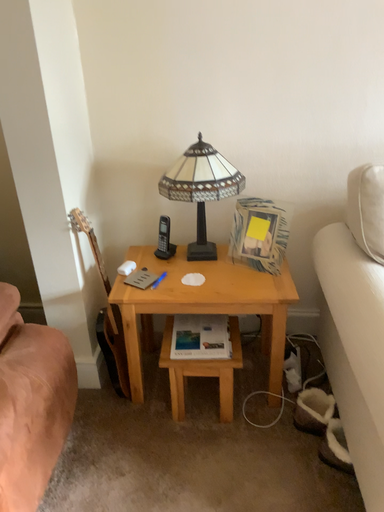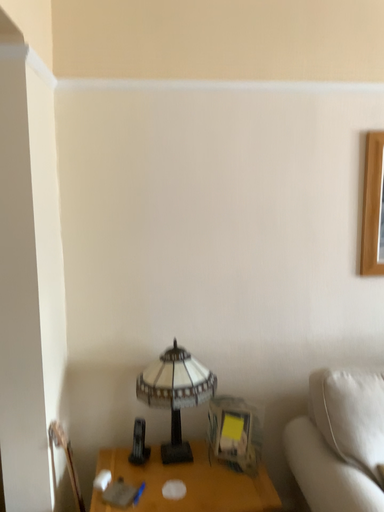
Question: How did the camera likely rotate when shooting the video?

Choices:
 (A) rotated upward
 (B) rotated downward

Answer: (A)